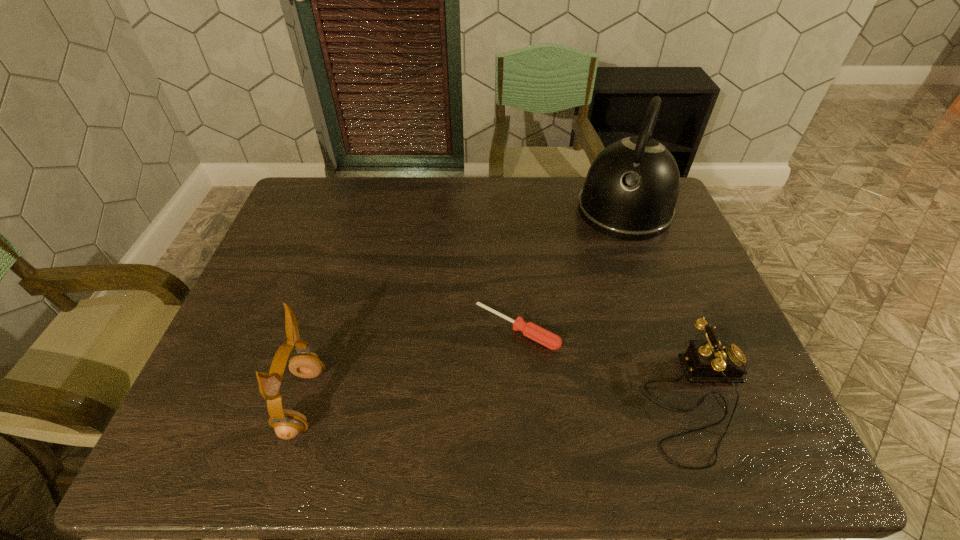
Where is `vacant space that satisfies the following two spatial constraints: 1. on the front side of the third object from right to left; 2. on the dial of the telephone`? vacant space that satisfies the following two spatial constraints: 1. on the front side of the third object from right to left; 2. on the dial of the telephone is located at coordinates (x=522, y=402).